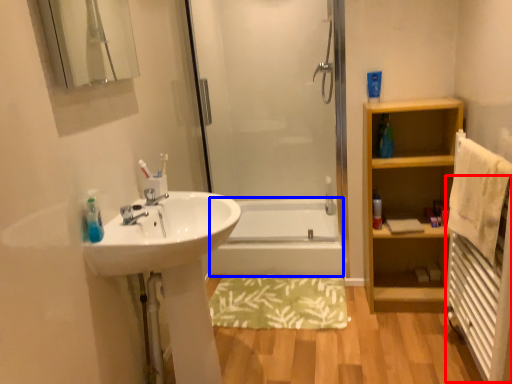
Question: Which point is further to the camera, radiator (highlighted by a red box) or bath (highlighted by a blue box)?

Choices:
 (A) radiator
 (B) bath

Answer: (B)